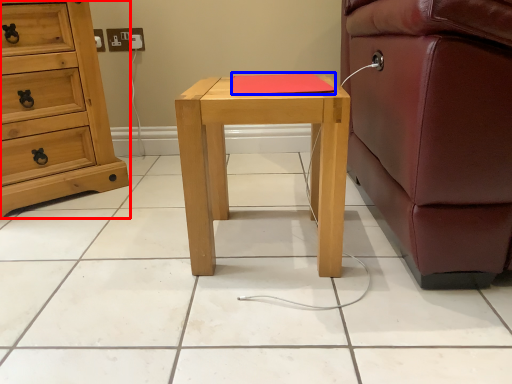
Question: Which point is further to the camera, chest of drawers (highlighted by a red box) or pad (highlighted by a blue box)?

Choices:
 (A) chest of drawers
 (B) pad

Answer: (A)